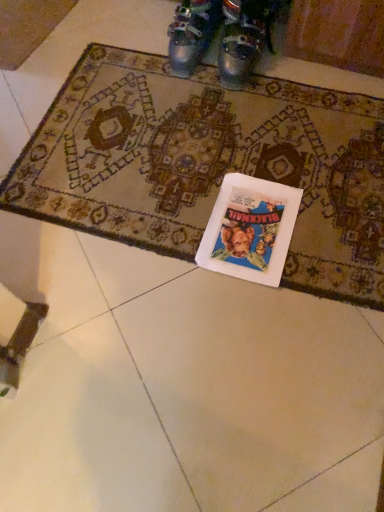
The height and width of the screenshot is (512, 384). I want to click on vacant point above white paper book at center (from a real-world perspective), so click(250, 222).